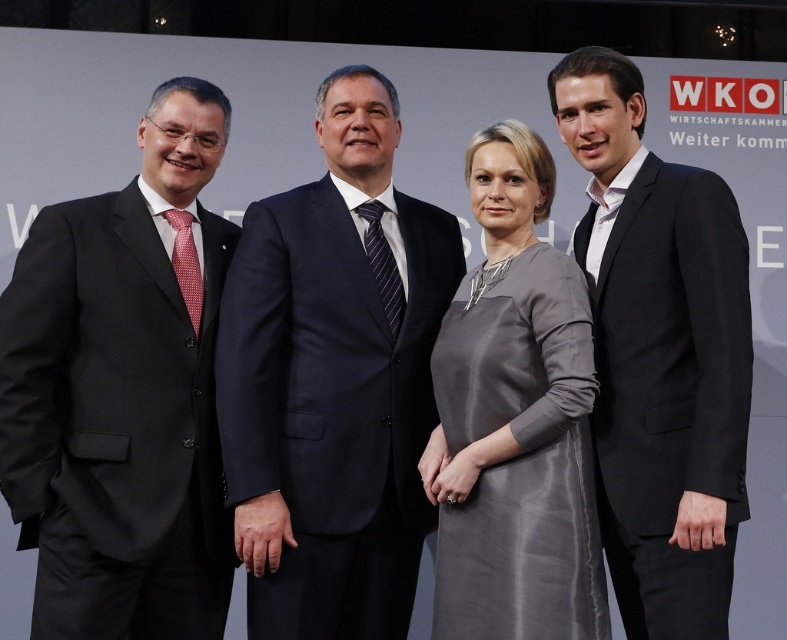
Which is behind, point (316, 195) or point (645, 314)?

Point (316, 195)

Is point (316, 356) positioned after point (652, 364)?

That is True.

This screenshot has width=787, height=640. I want to click on navy blue suit at center, so click(x=334, y=380).

Does black suit at right have a smaller size compared to satin gray dress at center?

Actually, black suit at right might be larger than satin gray dress at center.

Which is above, black suit at right or satin gray dress at center?

black suit at right

Is point (593, 60) farther from camera compared to point (545, 456)?

Yes, point (593, 60) is behind point (545, 456).

The width and height of the screenshot is (787, 640). I want to click on black suit at right, so click(660, 355).

Measure the distance from navy blue suit at center to satin gray dress at center.

35.00 centimeters

Is navy blue suit at center further to the viewer compared to satin gray dress at center?

That is True.

Does point (370, 580) lie in front of point (449, 513)?

No, (370, 580) is behind (449, 513).

Where is `navy blue suit at center`? navy blue suit at center is located at coordinates (334, 380).